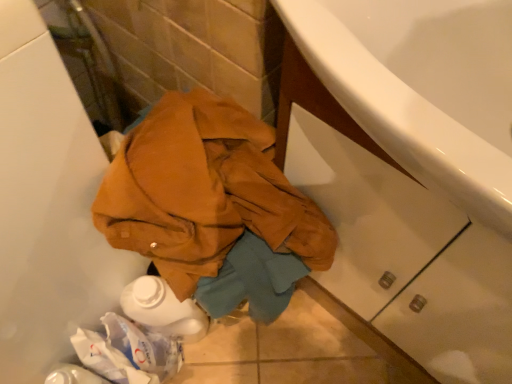
Question: Is leather jacket at center oriented away from white glossy cabinet at lower right?

Choices:
 (A) yes
 (B) no

Answer: (B)

Question: Is leather jacket at center touching white glossy cabinet at lower right?

Choices:
 (A) no
 (B) yes

Answer: (A)

Question: Is leather jacket at center taller than white glossy cabinet at lower right?

Choices:
 (A) yes
 (B) no

Answer: (B)

Question: Does leather jacket at center turn towards white glossy cabinet at lower right?

Choices:
 (A) yes
 (B) no

Answer: (B)

Question: Is white glossy cabinet at lower right surrounded by leather jacket at center?

Choices:
 (A) no
 (B) yes

Answer: (A)

Question: Is leather jacket at center wider than white glossy cabinet at lower right?

Choices:
 (A) yes
 (B) no

Answer: (B)

Question: Is white glossy cabinet at lower right surrounding leather jacket at center?

Choices:
 (A) yes
 (B) no

Answer: (B)

Question: Is white glossy cabinet at lower right placed right next to leather jacket at center?

Choices:
 (A) yes
 (B) no

Answer: (B)

Question: From the image's perspective, is white glossy cabinet at lower right over leather jacket at center?

Choices:
 (A) yes
 (B) no

Answer: (A)

Question: Considering the relative sizes of white glossy cabinet at lower right and leather jacket at center in the image provided, is white glossy cabinet at lower right bigger than leather jacket at center?

Choices:
 (A) no
 (B) yes

Answer: (B)

Question: Considering the relative sizes of white glossy cabinet at lower right and leather jacket at center in the image provided, is white glossy cabinet at lower right wider than leather jacket at center?

Choices:
 (A) yes
 (B) no

Answer: (A)

Question: Does white glossy cabinet at lower right have a greater height compared to leather jacket at center?

Choices:
 (A) no
 (B) yes

Answer: (B)

Question: Is leather jacket at center in front of or behind white glossy cabinet at lower right in the image?

Choices:
 (A) behind
 (B) front

Answer: (A)